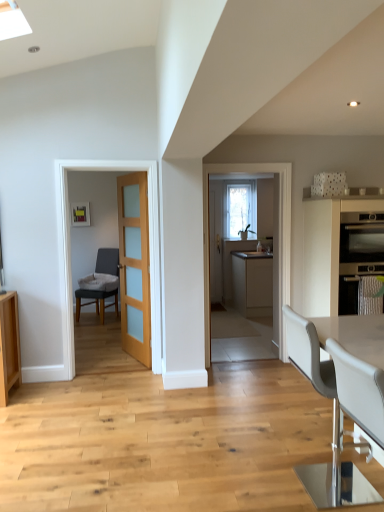
Locate an element on the screen. The image size is (384, 512). free spot behind white leather chair at lower right, placed as the second chair when sorted from front to back is located at coordinates (295, 447).